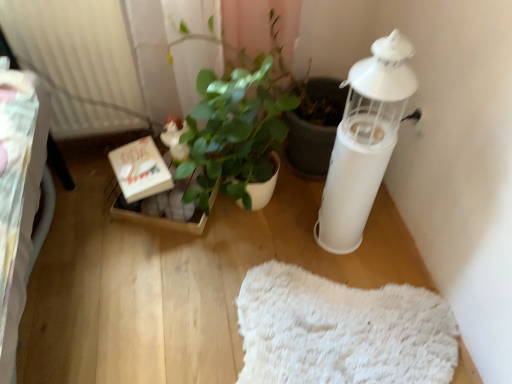
The image size is (512, 384). In order to click on vacant space situated above wooden cardboard box at center, marked as the second cardboard box in a front-to-back arrangement (from a real-world perspective) in this screenshot , I will do `click(163, 206)`.